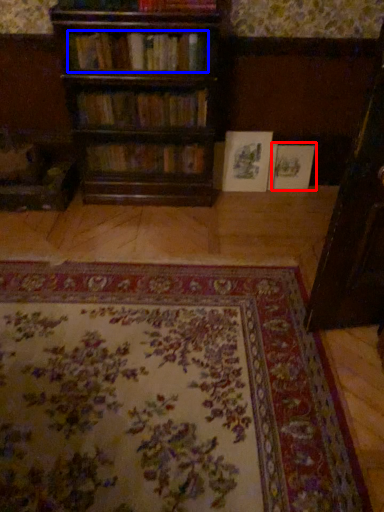
Question: Among these objects, which one is farthest to the camera, book (highlighted by a red box) or book (highlighted by a blue box)?

Choices:
 (A) book
 (B) book

Answer: (A)